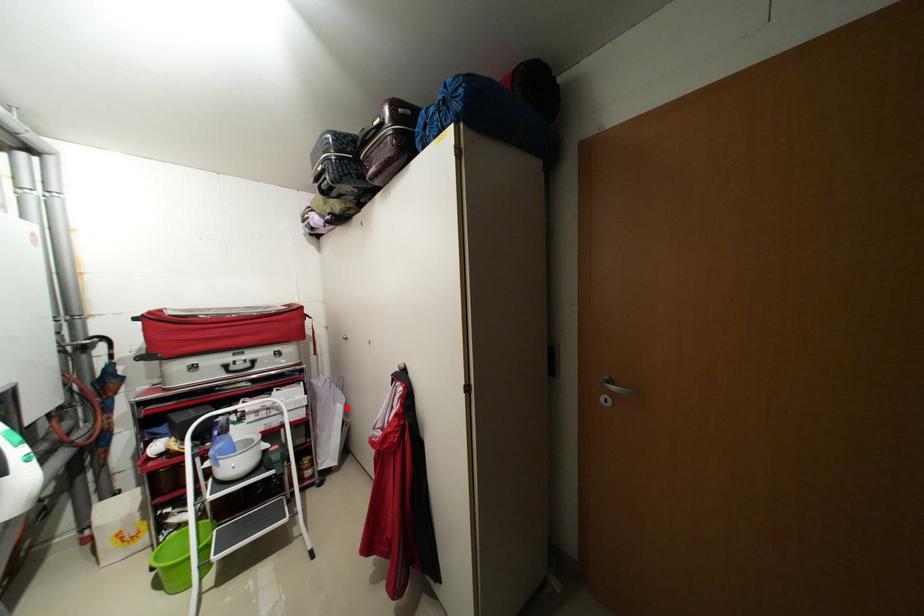
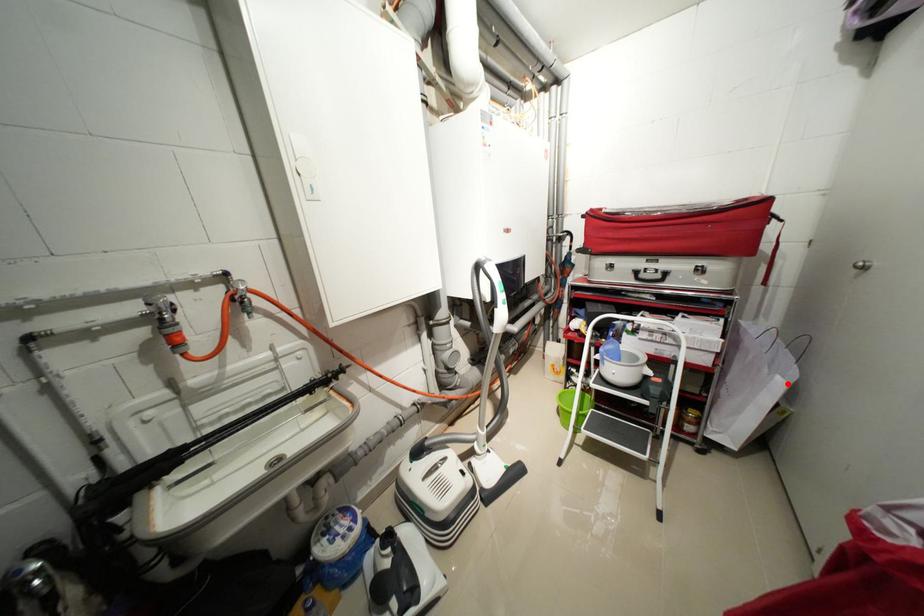
I am providing you with two images of the same scene from different viewpoints. A red point is marked on the first image and another point is marked on the second image. Is the marked point in image1 the same physical position as the marked point in image2?

Yes